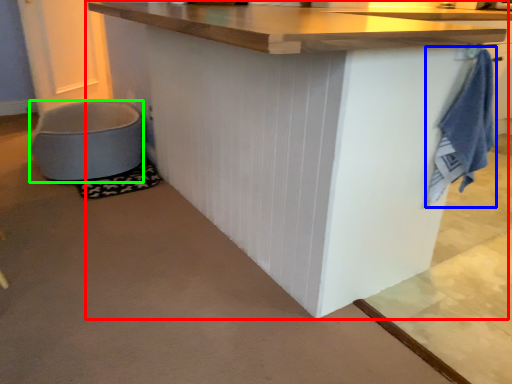
Question: Considering the real-world distances, which object is closest to table (highlighted by a red box)? bath towel (highlighted by a blue box) or toilet bowl (highlighted by a green box).

Choices:
 (A) bath towel
 (B) toilet bowl

Answer: (A)